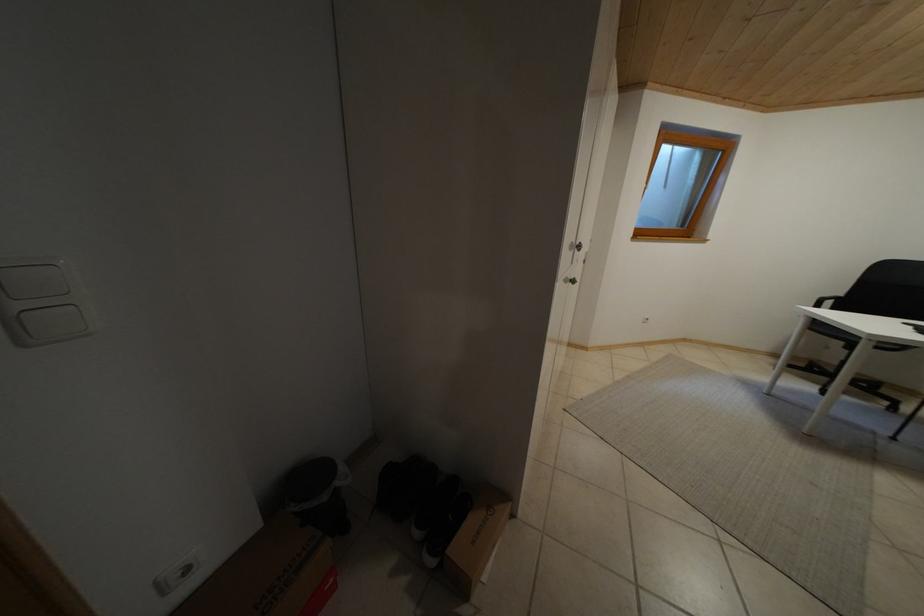
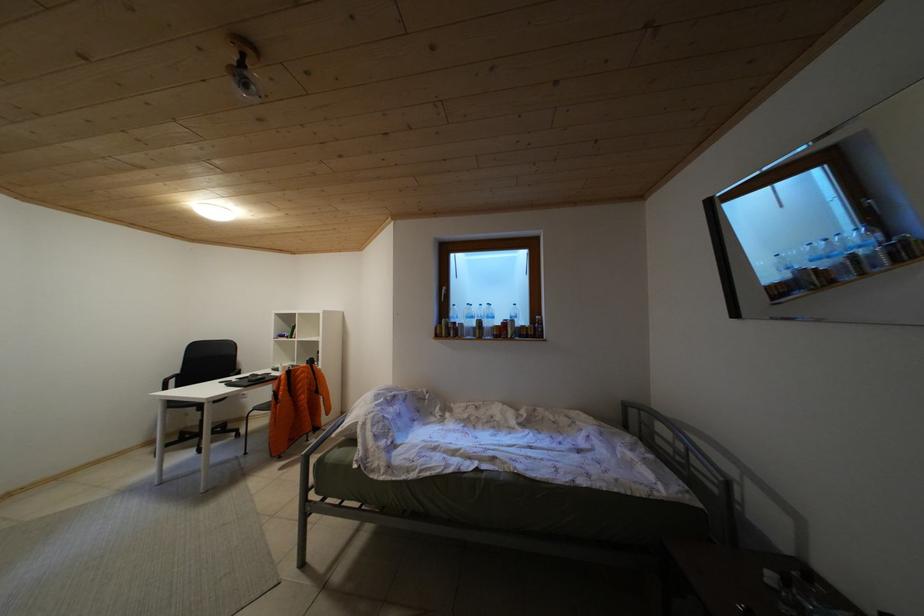
Question: The images are taken continuously from a first-person perspective. In which direction is your viewpoint rotating?

Choices:
 (A) Left
 (B) Right
 (C) Up
 (D) Down

Answer: (B)